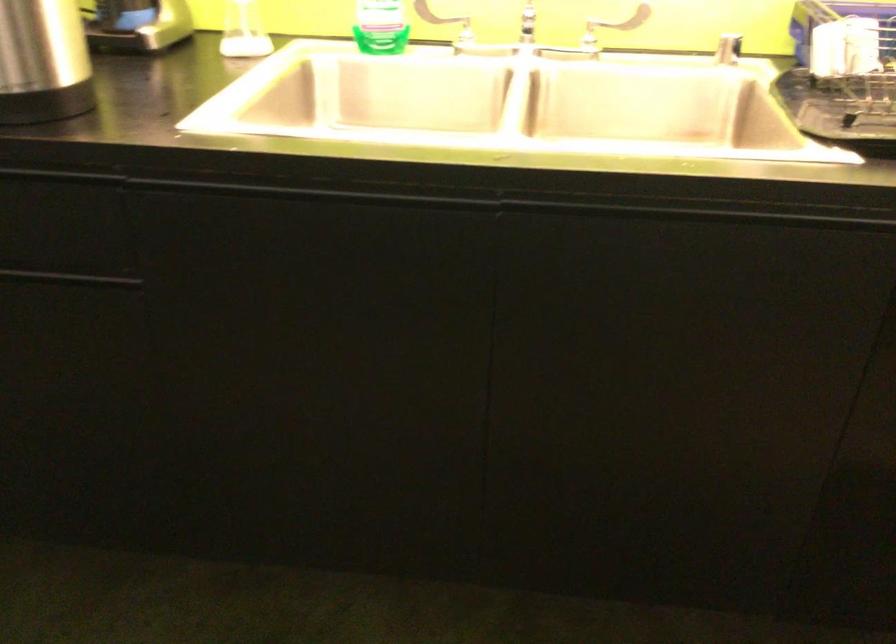
You are a GUI agent. You are given a task and a screenshot of the screen. Output one action in this format:
    pyautogui.click(x=<x>, y=<y>)
    Task: Click on the green bottle cap
    This screenshot has height=644, width=896.
    Given the screenshot: What is the action you would take?
    pyautogui.click(x=381, y=26)